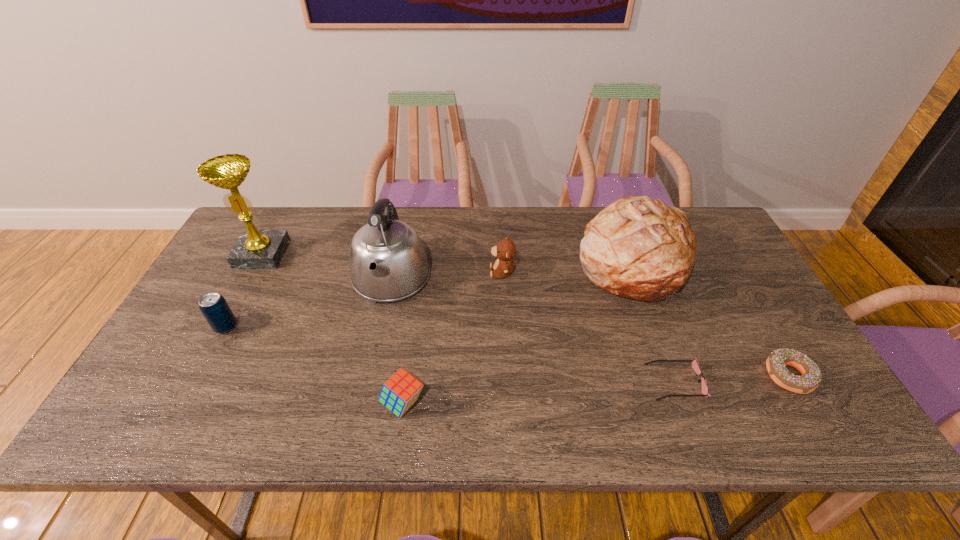
This screenshot has height=540, width=960. In order to click on vacant area situated 0.120m on the spout of the second tallest object in this screenshot , I will do `click(375, 354)`.

This screenshot has height=540, width=960. What are the coordinates of `vacant space situated on the left of the third tallest object` in the screenshot? It's located at (466, 264).

This screenshot has height=540, width=960. Find the location of `vacant region located 0.160m on the face of the teddy bear`. vacant region located 0.160m on the face of the teddy bear is located at coordinates (436, 272).

In order to click on free space located 0.100m on the face of the teddy bear in this screenshot , I will do `click(456, 272)`.

I want to click on free region located on the face of the teddy bear, so (x=436, y=272).

Where is `free space located on the right of the soda can`? The width and height of the screenshot is (960, 540). free space located on the right of the soda can is located at coordinates (378, 327).

Where is `vacant space located 0.210m on the left of the cube`? This screenshot has width=960, height=540. vacant space located 0.210m on the left of the cube is located at coordinates (288, 403).

Identify the location of vacant region located 0.200m on the back of the rightmost object. (743, 297).

Identify the location of vacant space situated 0.340m on the bridge of the shortest object. This screenshot has width=960, height=540. (505, 382).

Where is `vacant space situated on the bridge of the shortest object`? Image resolution: width=960 pixels, height=540 pixels. vacant space situated on the bridge of the shortest object is located at coordinates (620, 382).